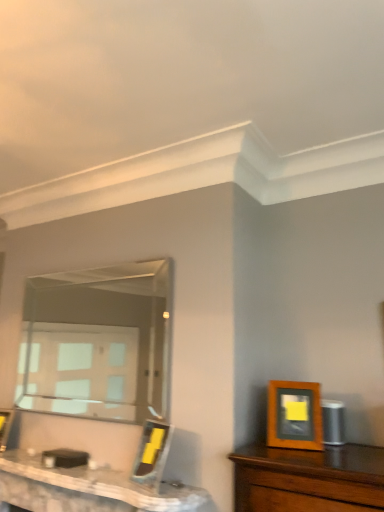
You are a GUI agent. You are given a task and a screenshot of the screen. Output one action in this format:
    pyautogui.click(x=<x>, y=<y>)
    Task: Click on the free space to the left of wooden picture frame at center, the 2th picture frame in the back-to-front sequence
    This screenshot has height=512, width=384.
    Given the screenshot: What is the action you would take?
    pyautogui.click(x=121, y=486)